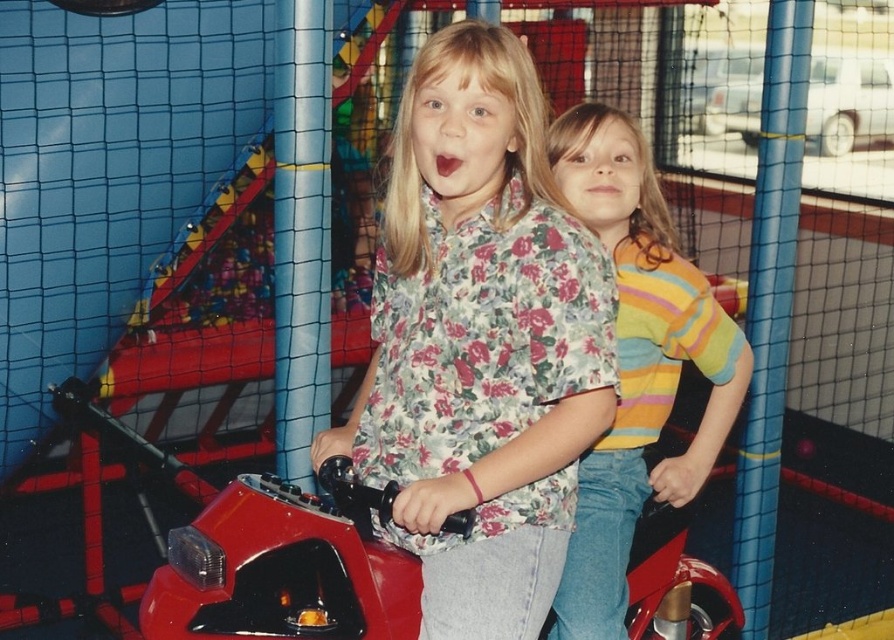
Looking at this image, can you confirm if striped cotton shirt at center is thinner than shiny red motorcycle at center?

Correct, striped cotton shirt at center's width is less than shiny red motorcycle at center's.

Is striped cotton shirt at center below shiny red motorcycle at center?

Incorrect, striped cotton shirt at center is not positioned below shiny red motorcycle at center.

The height and width of the screenshot is (640, 894). Describe the element at coordinates (637, 362) in the screenshot. I see `striped cotton shirt at center` at that location.

I want to click on striped cotton shirt at center, so click(637, 362).

Who is more forward, (521, 227) or (226, 589)?

Point (521, 227) is more forward.

Does floral print shirt at center appear under shiny red motorcycle at center?

No, floral print shirt at center is not below shiny red motorcycle at center.

Does point (515, 266) lie behind point (179, 608)?

No, it is in front of (179, 608).

You are a GUI agent. You are given a task and a screenshot of the screen. Output one action in this format:
    pyautogui.click(x=<x>, y=<y>)
    Task: Click on the floral print shirt at center
    The width and height of the screenshot is (894, 640).
    Given the screenshot: What is the action you would take?
    pyautogui.click(x=479, y=340)

Locate an element on the screen. Image resolution: width=894 pixels, height=640 pixels. floral print shirt at center is located at coordinates (479, 340).

Is point (486, 291) farther from viewer compared to point (654, 316)?

No.

You are a GUI agent. You are given a task and a screenshot of the screen. Output one action in this format:
    pyautogui.click(x=<x>, y=<y>)
    Task: Click on the floral print shirt at center
    Image resolution: width=894 pixels, height=640 pixels.
    Given the screenshot: What is the action you would take?
    pyautogui.click(x=479, y=340)